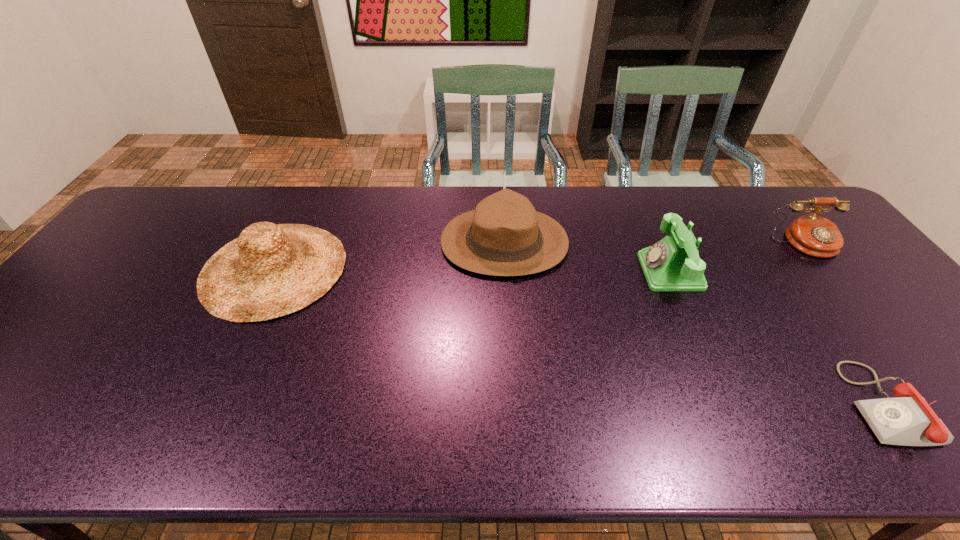
I want to click on telephone that is the third closest to the fedora, so click(813, 235).

This screenshot has width=960, height=540. What are the coordinates of `free location that satisfies the following two spatial constraints: 1. on the dial of the second tallest telephone; 2. on the dial of the third object from left to right` in the screenshot? It's located at (828, 272).

At what (x,y) coordinates should I click in order to perform the action: click on free space that satisfies the following two spatial constraints: 1. on the dial of the second shortest telephone; 2. on the dial of the leftmost telephone. Please return your answer as a coordinate pair (x, y). This screenshot has width=960, height=540. Looking at the image, I should click on (828, 272).

Where is `free spot that satisfies the following two spatial constraints: 1. on the dial of the second shortest telephone; 2. on the dial of the third object from right to left`? This screenshot has width=960, height=540. free spot that satisfies the following two spatial constraints: 1. on the dial of the second shortest telephone; 2. on the dial of the third object from right to left is located at coordinates (828, 272).

What are the coordinates of `vacant area in the image that satisfies the following two spatial constraints: 1. on the feather side of the tallest object; 2. on the front side of the sunhat` in the screenshot? It's located at coord(506,269).

Image resolution: width=960 pixels, height=540 pixels. In order to click on vacant space that satisfies the following two spatial constraints: 1. on the dial of the second tallest telephone; 2. on the dial of the third object from left to right in this screenshot , I will do `click(828, 272)`.